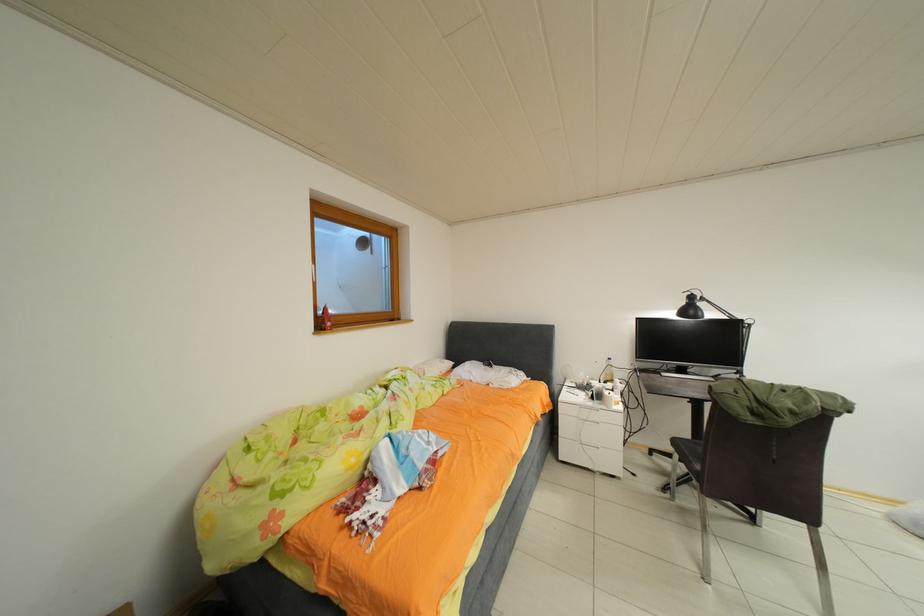
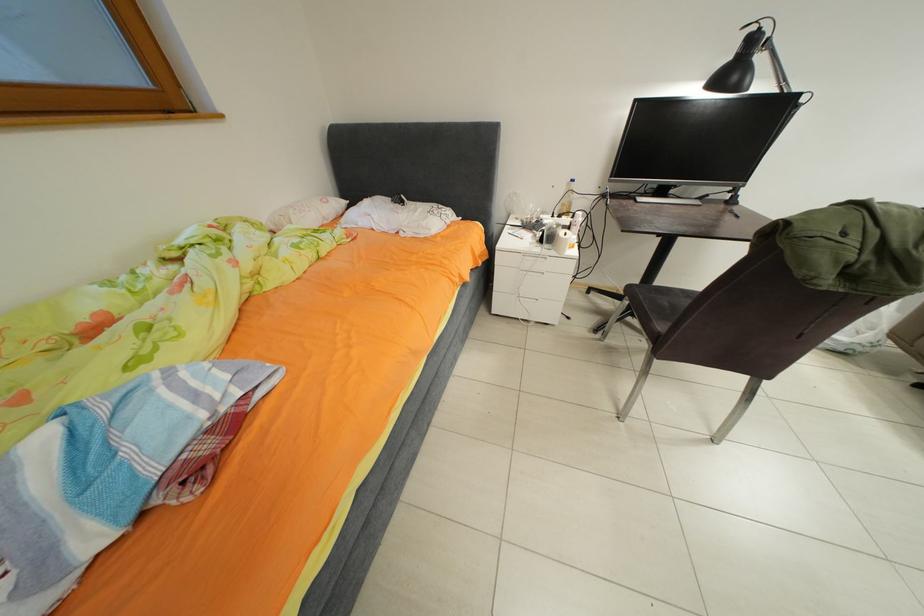
Question: The images are taken continuously from a first-person perspective. In which direction is your viewpoint rotating?

Choices:
 (A) Left
 (B) Right
 (C) Up
 (D) Down

Answer: (D)